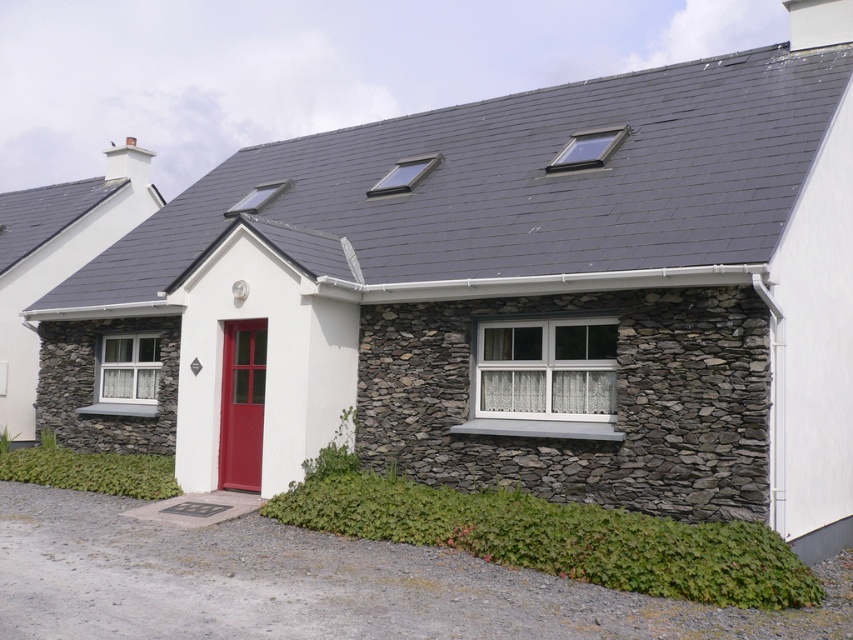
Is gray gravel driveway at lower left to the left of matte red door at center from the viewer's perspective?

In fact, gray gravel driveway at lower left is to the right of matte red door at center.

Who is more distant from viewer, (363, 548) or (225, 481)?

The point (225, 481) is more distant.

Is point (651, 627) positioned before point (248, 403)?

Yes, it is.

Where is `gray gravel driveway at lower left`? The height and width of the screenshot is (640, 853). gray gravel driveway at lower left is located at coordinates (318, 584).

Is gray gravel driveway at lower left above white stone wall at upper left?

No, gray gravel driveway at lower left is not above white stone wall at upper left.

Image resolution: width=853 pixels, height=640 pixels. What do you see at coordinates (318, 584) in the screenshot?
I see `gray gravel driveway at lower left` at bounding box center [318, 584].

Does point (463, 556) come closer to viewer compared to point (0, 390)?

Yes, point (463, 556) is closer to viewer.

Identify the location of gray gravel driveway at lower left. This screenshot has width=853, height=640. (318, 584).

Is white stone wall at upper left to the right of matte red door at center from the viewer's perspective?

Incorrect, white stone wall at upper left is not on the right side of matte red door at center.

Who is more forward, (48, 209) or (262, 376)?

Point (262, 376) is more forward.

Between point (4, 376) and point (251, 460), which one is positioned in front?

Point (251, 460)

Find the location of a particular element. Image resolution: width=853 pixels, height=640 pixels. white stone wall at upper left is located at coordinates (57, 259).